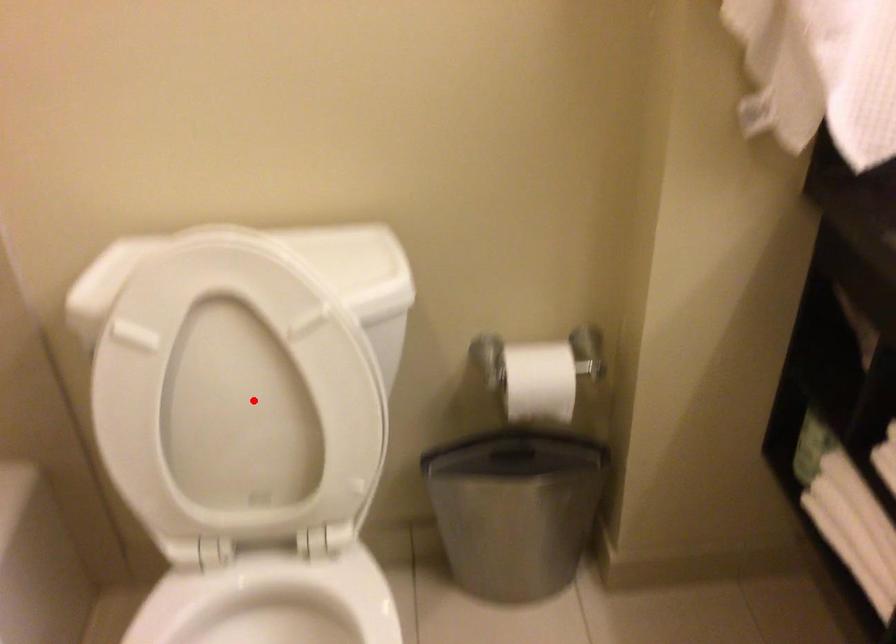
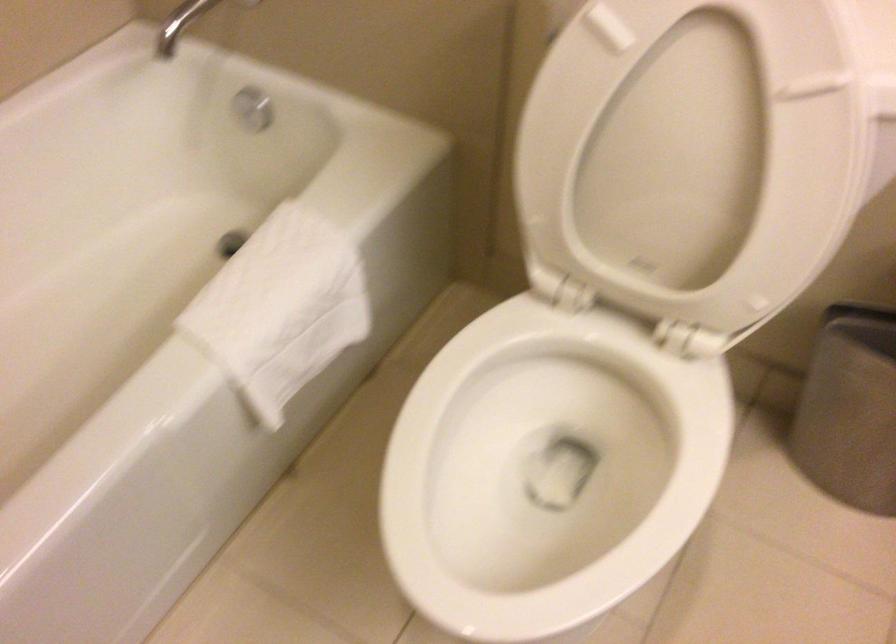
Question: A red point is marked in image1. In image2, is the corresponding 3D point closer to the camera or farther? Reply with the corresponding letter.

Choices:
 (A) The corresponding 3D point is closer.
 (B) The corresponding 3D point is farther.

Answer: (A)